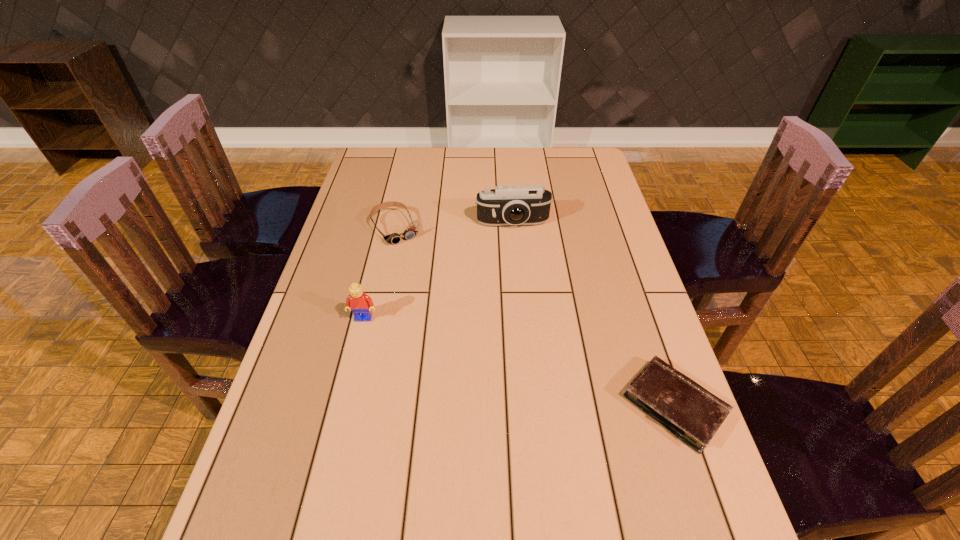
Find the location of a particular element. This screenshot has width=960, height=540. unoccupied area between the camera and the shortest object is located at coordinates (594, 314).

I want to click on object that is the second closest to the third object from left to right, so click(360, 304).

Select which object appears as the second closest to the camera. Please provide its 2D coordinates. Your answer should be formatted as a tuple, i.e. [(x, y)], where the tuple contains the x and y coordinates of a point satisfying the conditions above.

[(360, 304)]